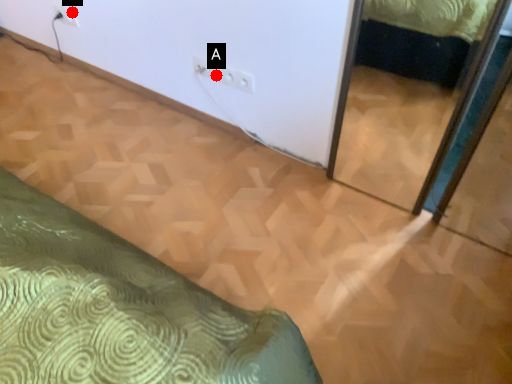
Question: Two points are circled on the image, labeled by A and B beside each circle. Which point is closer to the camera?

Choices:
 (A) A is closer
 (B) B is closer

Answer: (A)